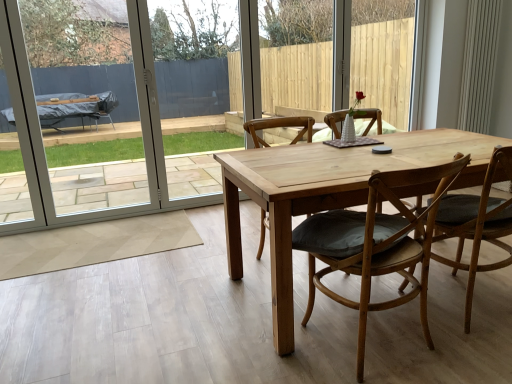
The image size is (512, 384). Identify the location of free space underneath white plastic screen door at left (from a real-world perspective). (106, 213).